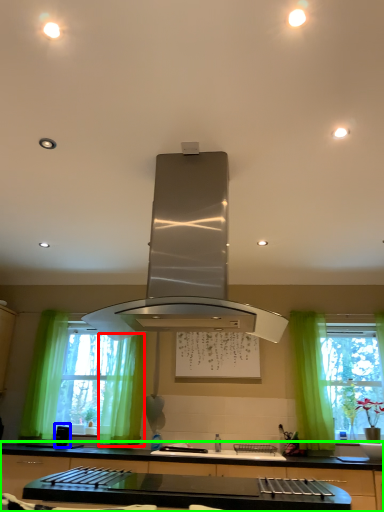
Question: Which object is positioned closest to curtain (highlighted by a red box)? Select from appliance (highlighted by a blue box) and countertop (highlighted by a green box).

Choices:
 (A) appliance
 (B) countertop

Answer: (A)